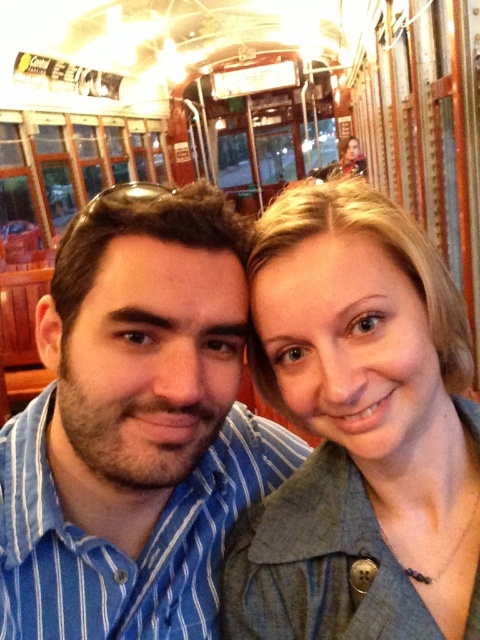
Between point (24, 612) and point (456, 330), which one is positioned behind?

Point (24, 612)

What are the coordinates of `blue striped shirt at center` in the screenshot? It's located at (x=134, y=428).